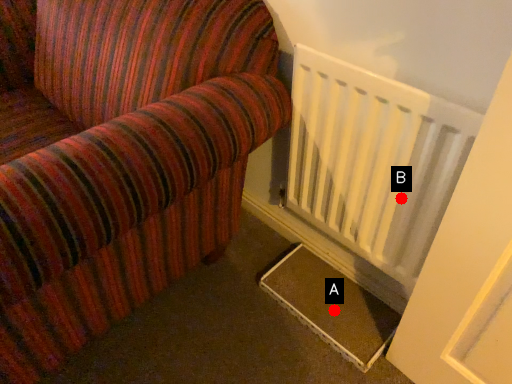
Question: Two points are circled on the image, labeled by A and B beside each circle. Which of the following is the closest to the observer?

Choices:
 (A) A is closer
 (B) B is closer

Answer: (B)